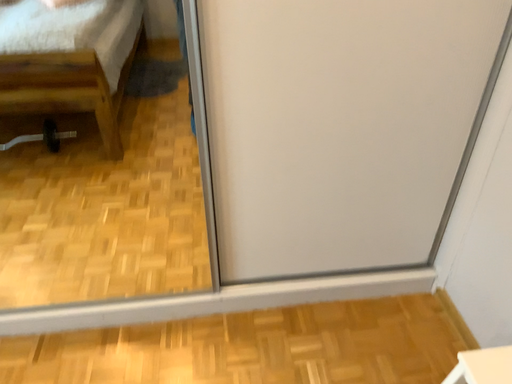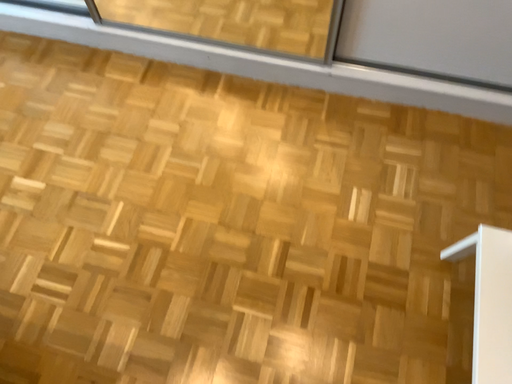
Question: How did the camera likely rotate when shooting the video?

Choices:
 (A) rotated upward
 (B) rotated downward

Answer: (B)